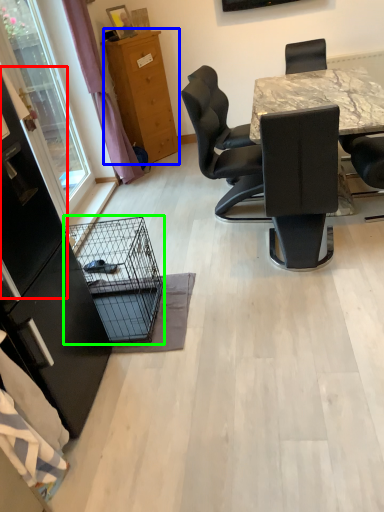
Question: Which object is positioned farthest from screen door (highlighted by a red box)? Select from cabinetry (highlighted by a blue box) and bird cage (highlighted by a green box).

Choices:
 (A) cabinetry
 (B) bird cage

Answer: (A)